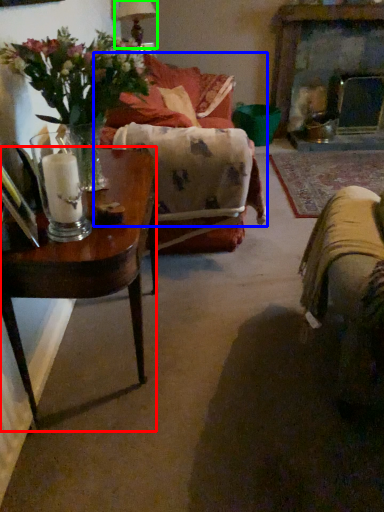
Question: Estimate the real-world distances between objects in this image. Which object is closer to table (highlighted by a red box), couch (highlighted by a blue box) or lamp (highlighted by a green box)?

Choices:
 (A) couch
 (B) lamp

Answer: (A)